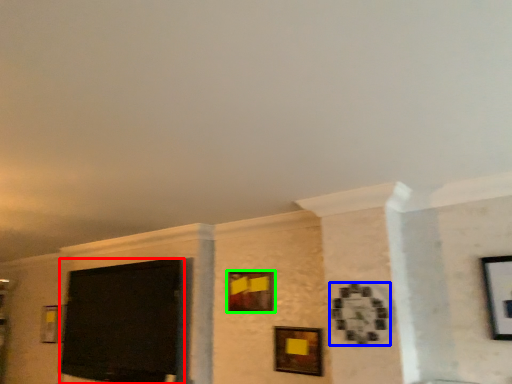
Question: Considering the real-world distances, which object is closest to projection screen (highlighted by a red box)? picture frame (highlighted by a blue box) or picture frame (highlighted by a green box).

Choices:
 (A) picture frame
 (B) picture frame

Answer: (B)